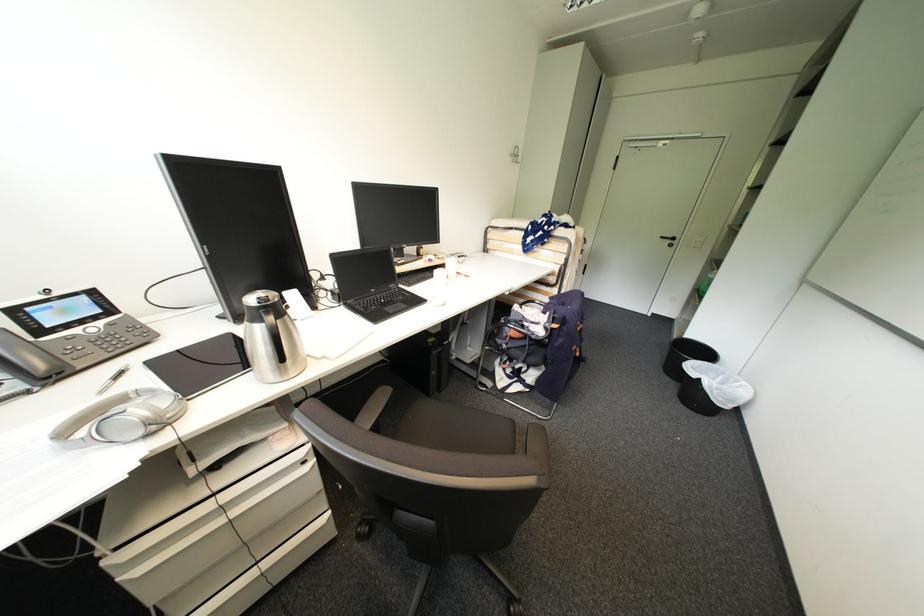
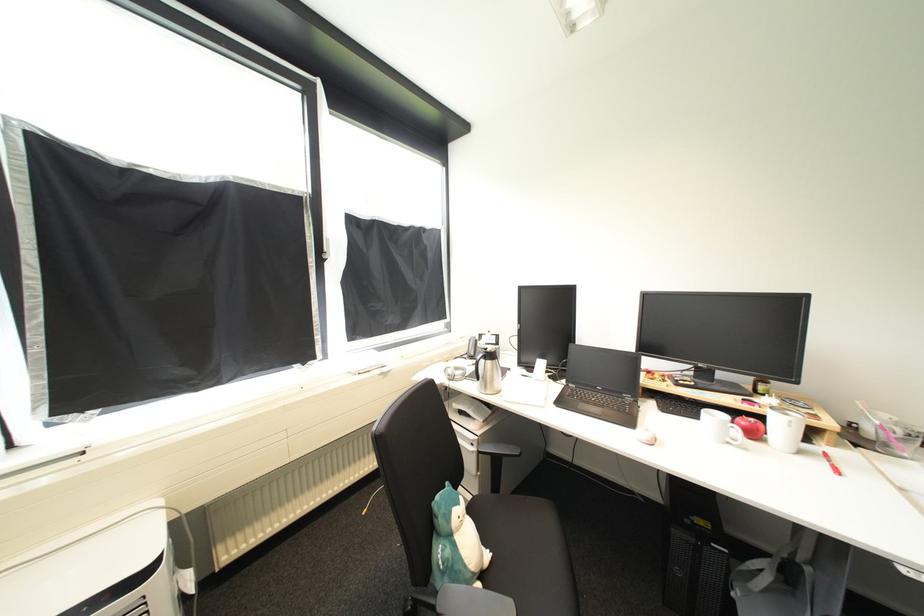
In the second image, find the point that corresponds to point 469,277 in the first image.

(834, 464)